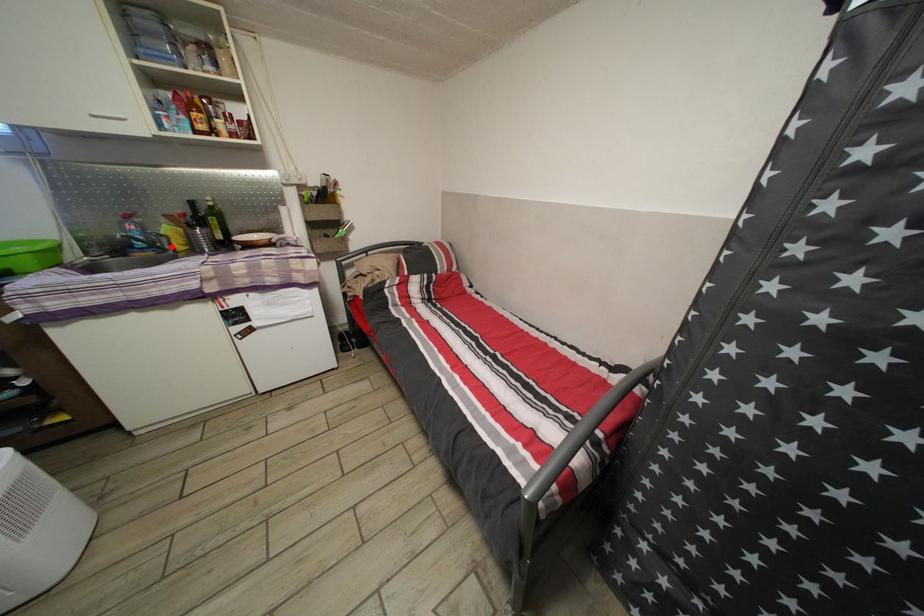
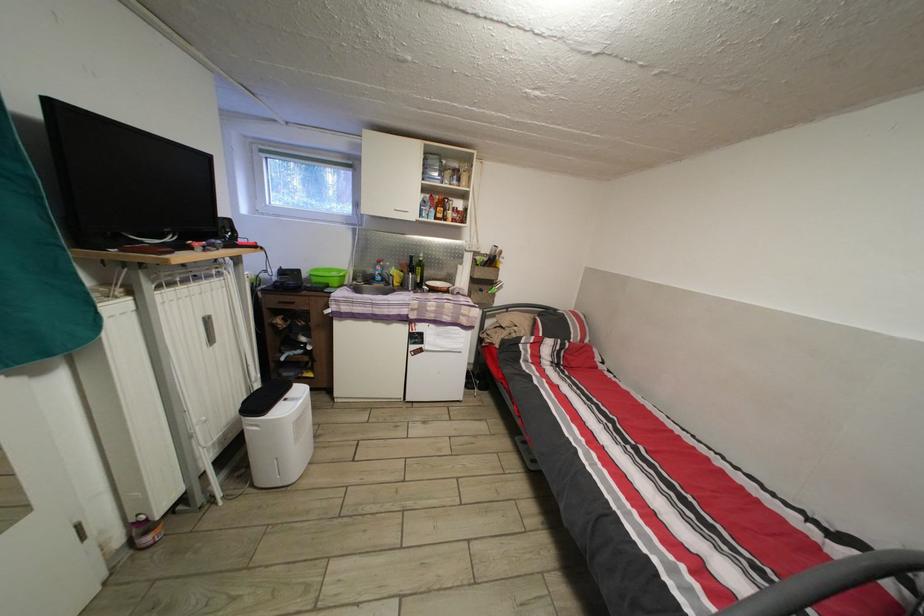
Locate, in the second image, the point that corresponds to the highlighted location in the first image.

(398, 285)